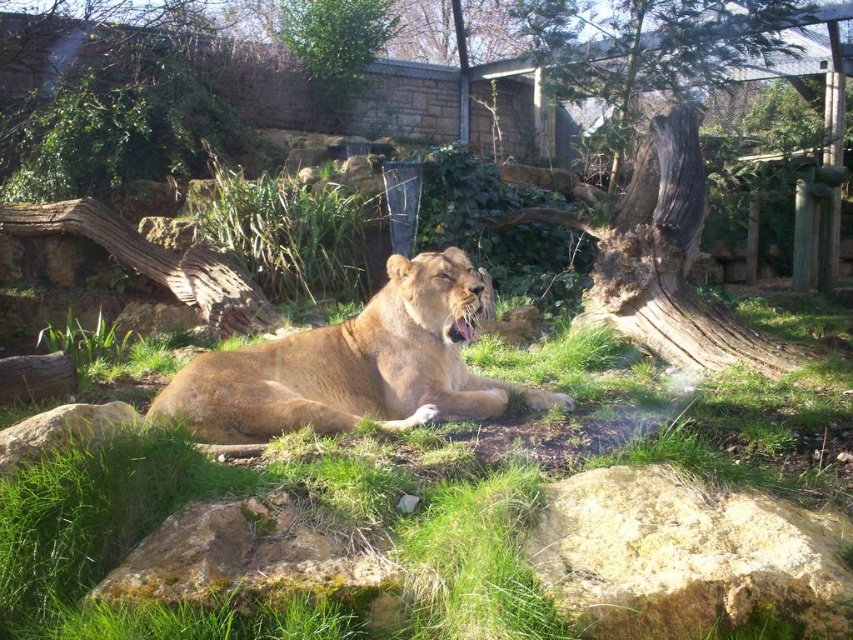
Can you confirm if brown textured wood at center is shorter than yellowish rock at lower right?

No, brown textured wood at center is not shorter than yellowish rock at lower right.

Can you confirm if brown textured wood at center is positioned to the left of yellowish rock at lower right?

In fact, brown textured wood at center is to the right of yellowish rock at lower right.

This screenshot has width=853, height=640. In order to click on brown textured wood at center in this screenshot , I will do `click(674, 176)`.

At what (x,y) coordinates should I click in order to perform the action: click on brown textured wood at center. Please return your answer as a coordinate pair (x, y). The height and width of the screenshot is (640, 853). Looking at the image, I should click on (674, 176).

Can you confirm if yellowish rock at lower right is shorter than golden fur lion at center?

Yes, yellowish rock at lower right is shorter than golden fur lion at center.

Is yellowish rock at lower right wider than golden fur lion at center?

No, yellowish rock at lower right is not wider than golden fur lion at center.

Is point (695, 561) positioned before point (218, 426)?

Yes, it is in front of point (218, 426).

Find the location of a particular element. The width and height of the screenshot is (853, 640). yellowish rock at lower right is located at coordinates (683, 556).

Which is more to the left, green grass at center or brown textured wood at center?

Positioned to the left is green grass at center.

Can you confirm if green grass at center is bigger than brown textured wood at center?

Yes, green grass at center is bigger than brown textured wood at center.

Who is more distant from viewer, (666,378) or (793,8)?

The point (793,8) is behind.

This screenshot has height=640, width=853. Identify the location of green grass at center. [x=421, y=488].